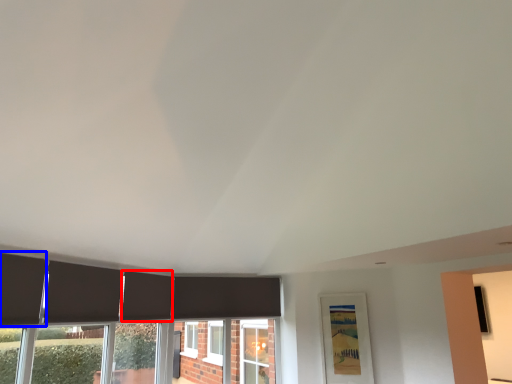
Question: Which object appears closest to the camera in this image, curtain (highlighted by a red box) or curtain (highlighted by a blue box)?

Choices:
 (A) curtain
 (B) curtain

Answer: (B)